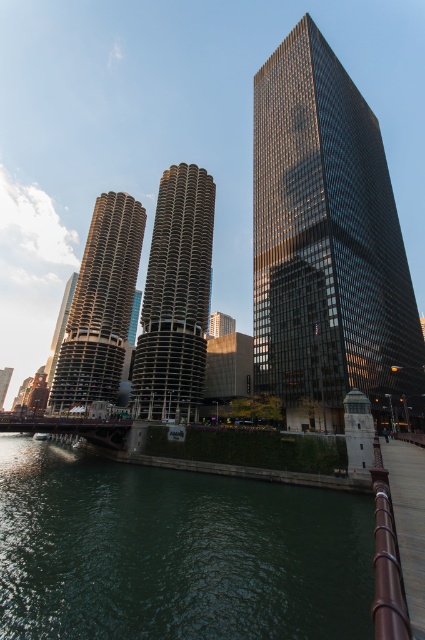
Who is more distant from viewer, (104,464) or (6,381)?

The point (6,381) is more distant.

Looking at this image, is the position of green water at lower left more distant than that of matte glass skyscraper at center?

No, it is not.

Does point (229, 493) come farther from viewer compared to point (0, 380)?

That is False.

Locate an element on the screen. The height and width of the screenshot is (640, 425). green water at lower left is located at coordinates (175, 552).

Is glossy glass skyscraper at upper center bigger than metallic gray boat at lower left?

Yes, glossy glass skyscraper at upper center is bigger than metallic gray boat at lower left.

Can you confirm if glossy glass skyscraper at upper center is wider than metallic gray boat at lower left?

Correct, the width of glossy glass skyscraper at upper center exceeds that of metallic gray boat at lower left.

This screenshot has height=640, width=425. Describe the element at coordinates (326, 243) in the screenshot. I see `glossy glass skyscraper at upper center` at that location.

Find the location of a particular element. glossy glass skyscraper at upper center is located at coordinates (326, 243).

Which is above, green water at lower left or metallic gray boat at lower left?

Positioned higher is green water at lower left.

Consider the image. Which of these two, green water at lower left or metallic gray boat at lower left, stands shorter?

Standing shorter between the two is metallic gray boat at lower left.

Which is in front, point (158, 545) or point (42, 438)?

Positioned in front is point (158, 545).

Locate an element on the screen. Image resolution: width=425 pixels, height=640 pixels. green water at lower left is located at coordinates (175, 552).